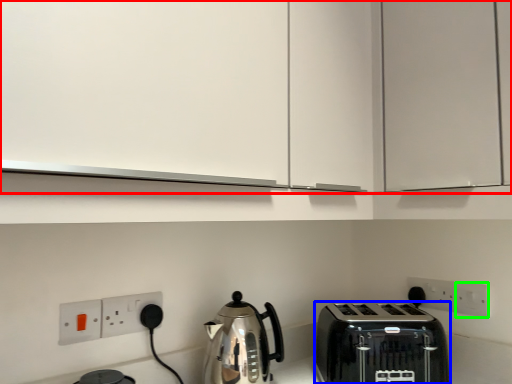
Question: Which object is the farthest from cabinetry (highlighted by a red box)? Choose among these: toaster (highlighted by a blue box) or electric outlet (highlighted by a green box).

Choices:
 (A) toaster
 (B) electric outlet

Answer: (B)